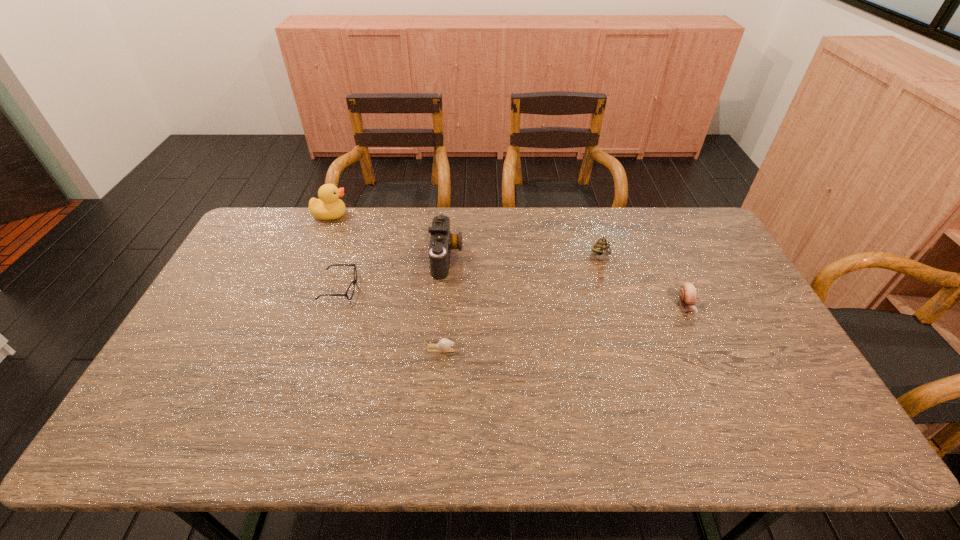
Locate an element on the screen. This screenshot has height=540, width=960. the farthest object is located at coordinates (328, 207).

Find the location of `the second escargot from left to right`. the second escargot from left to right is located at coordinates (602, 248).

Locate an element on the screen. This screenshot has width=960, height=540. the farthest escargot is located at coordinates point(602,248).

Image resolution: width=960 pixels, height=540 pixels. Identify the location of camera. (442, 241).

Identify the location of the rightmost escargot. The image size is (960, 540). (687, 293).

Locate an element on the screen. the second tallest escargot is located at coordinates [687, 293].

Locate an element on the screen. the second shortest object is located at coordinates (354, 281).

Locate an element on the screen. the nearest object is located at coordinates (444, 345).

The image size is (960, 540). What are the coordinates of `the nearest escargot` in the screenshot? It's located at (444, 345).

This screenshot has height=540, width=960. What are the coordinates of `free location located at the beak of the duck` in the screenshot? It's located at (378, 215).